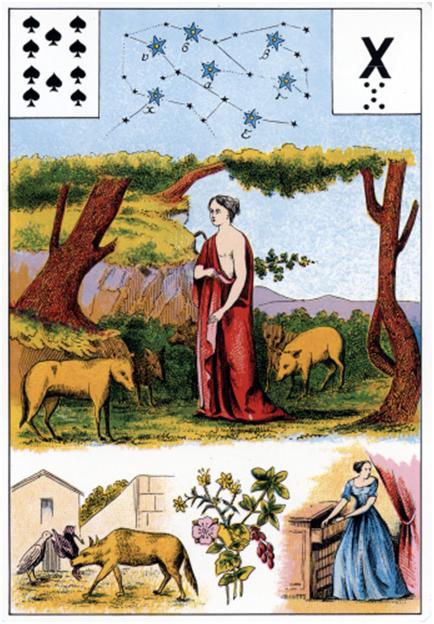
Where is `poster`? poster is located at coordinates (212, 249).